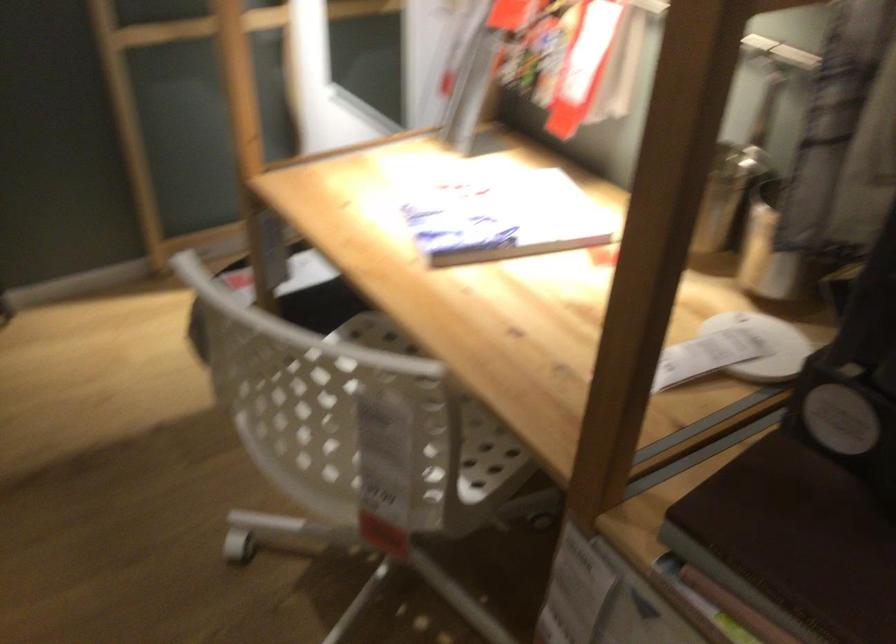
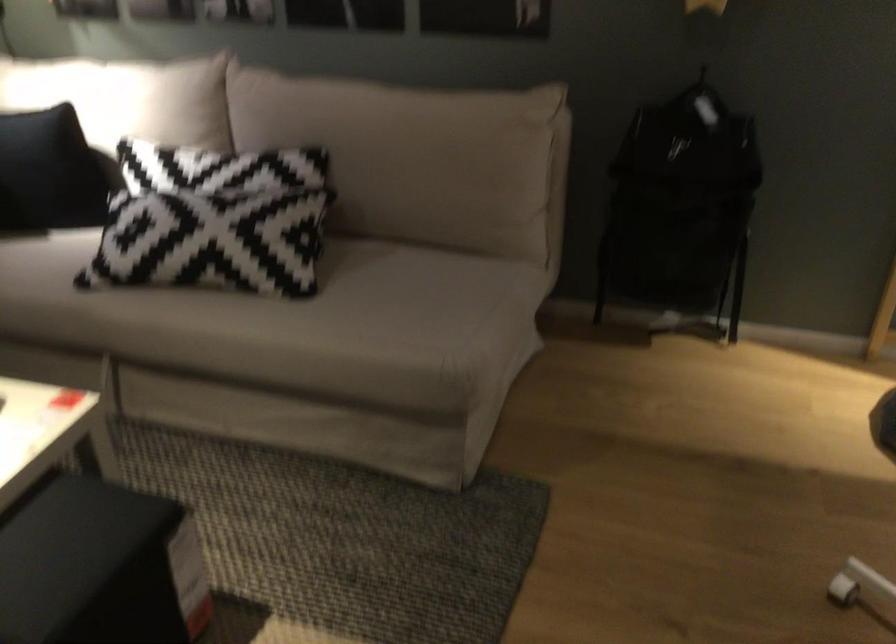
Question: The first image is from the beginning of the video and the second image is from the end. How did the camera likely rotate when shooting the video?

Choices:
 (A) Left
 (B) Right
 (C) Up
 (D) Down

Answer: (A)